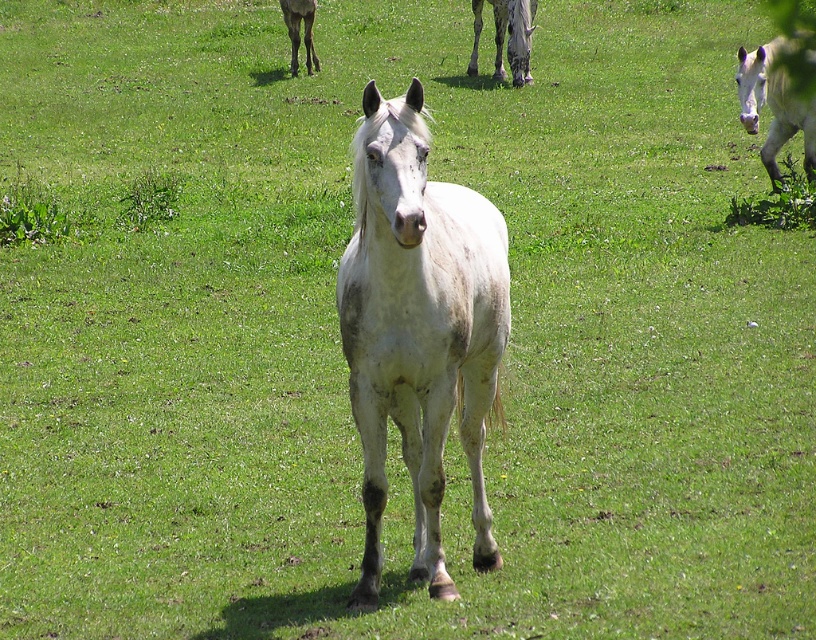
Who is higher up, white speckled horse at center or white matte horse at upper right?

white matte horse at upper right is higher up.

I want to click on white speckled horse at center, so click(x=419, y=330).

Does white matte horse at upper right have a greater width compared to speckled gray horse at upper center?

Indeed, white matte horse at upper right has a greater width compared to speckled gray horse at upper center.

Between point (770, 65) and point (526, 83), which one is positioned in front?

Point (770, 65) is more forward.

Is point (809, 141) behind point (522, 0)?

No, (809, 141) is closer to viewer.

This screenshot has height=640, width=816. I want to click on white matte horse at upper right, so click(x=774, y=106).

Can you confirm if speckled gray horse at upper center is positioned below white speckled coat at center?

Correct, speckled gray horse at upper center is located below white speckled coat at center.

Which is in front, point (499, 36) or point (309, 24)?

Point (499, 36) is in front.

Find the location of a particular element. The image size is (816, 640). speckled gray horse at upper center is located at coordinates (513, 36).